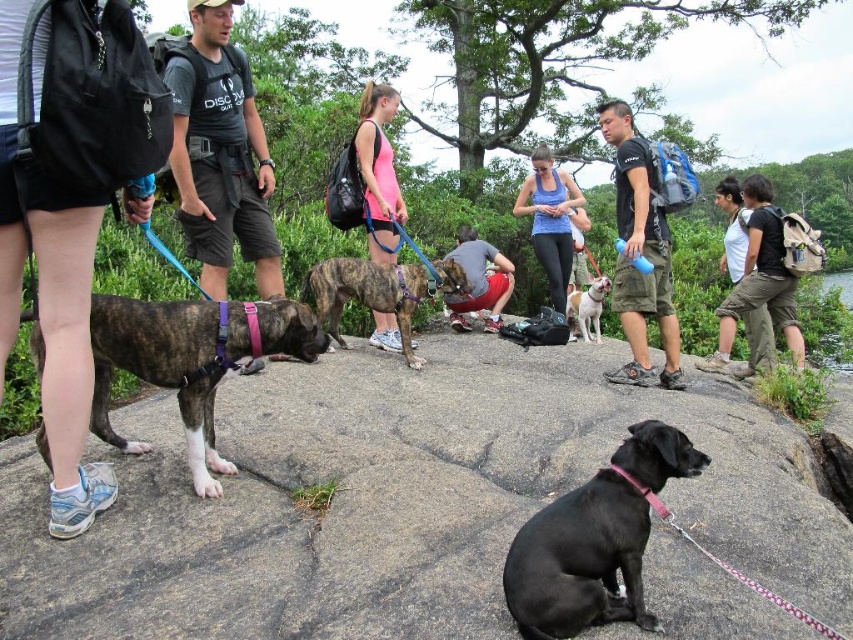
Consider the image. You are a photographer trying to capture a candid shot of the person in the pink fabric tank top at center and the person in the matte black shorts at left. Since you want to focus on their faces, which person should you adjust your camera focus to first based on their position?

The matte black shorts at left is positioned under the pink fabric tank top at center, so you should focus on the person in the matte black shorts at left first because they are closer to the camera.

Looking at this image, you are a photographer standing at the center of the rocky outcrop. You want to take a photo of the brindle fur dog at center. According to the coordinates provided, where should you position your camera to ensure the dog is centered in the frame?

The brindle fur dog at center is located at coordinates point (190, 360), so position your camera to center the frame at those coordinates to capture the dog in the center of the photo.

You are standing at the edge of the rocky outcrop and want to place a small picnic basket exactly at the center of the black smooth rock at center. Given that the coordinates of the rock are point (396, 500), can you confirm if this point is suitable for placing the basket without it rolling off?

The point (396, 500) corresponds to the black smooth rock at center, so placing the picnic basket there should be stable as it is the center of the rock.